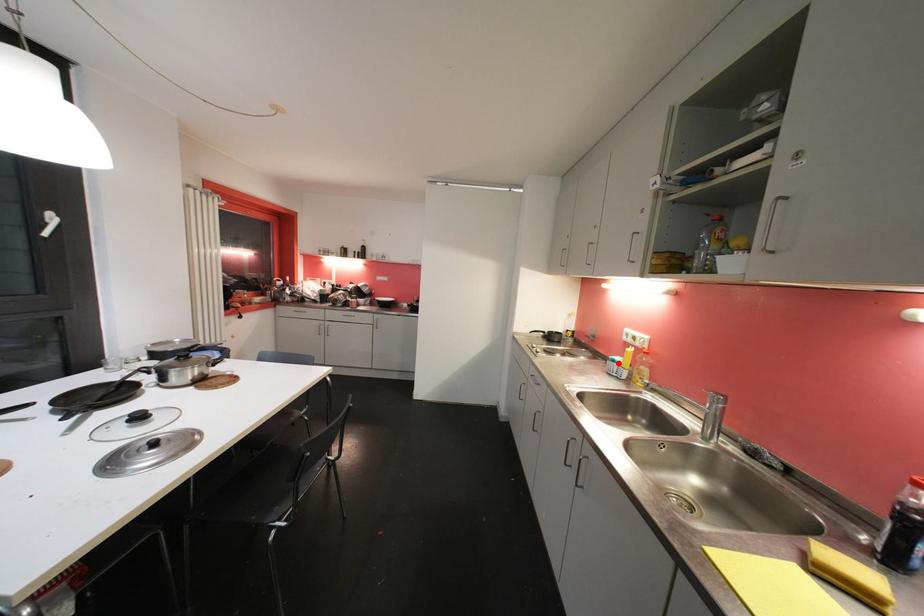
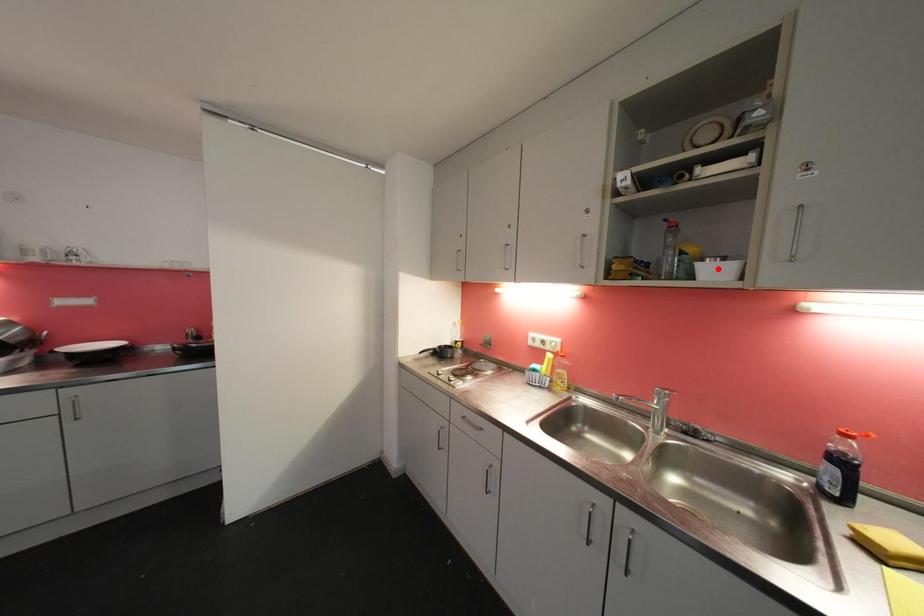
I am providing you with two images of the same scene from different viewpoints. A red point is marked on the first image and another point is marked on the second image. Are the points marked in image1 and image2 representing the same 3D position?

No